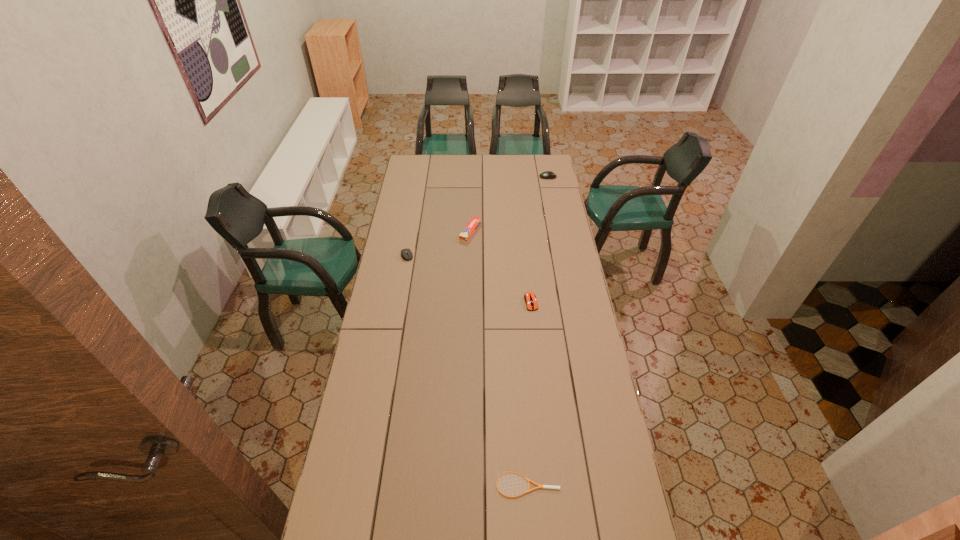
Identify the location of vacant area situated 0.370m on the front of the fourth nearest object. Image resolution: width=960 pixels, height=540 pixels. (469, 296).

Find the location of a particular element. The image size is (960, 540). blank area located 0.060m on the wheel side of the farthest object is located at coordinates (529, 177).

Find the location of `vacant space situated on the wheel side of the farthest object`. vacant space situated on the wheel side of the farthest object is located at coordinates (475, 177).

I want to click on vacant area situated on the wheel side of the farthest object, so click(x=484, y=177).

Locate an element on the screen. free location located 0.260m on the front of the leftmost computer mouse is located at coordinates (399, 301).

Locate an element on the screen. vacant area located on the front of the fourth farthest object is located at coordinates (538, 367).

Find the location of a particular element. The image size is (960, 540). free space located 0.390m on the left of the tennis racket is located at coordinates (372, 484).

The height and width of the screenshot is (540, 960). Identify the location of object that is at the far edge. (548, 174).

The image size is (960, 540). What are the coordinates of `object at the left edge` in the screenshot? It's located at (404, 252).

You are a GUI agent. You are given a task and a screenshot of the screen. Output one action in this format:
    pyautogui.click(x=<x>, y=<y>)
    Task: Click on the object that is at the right edge
    The image size is (960, 540).
    Given the screenshot: What is the action you would take?
    pyautogui.click(x=548, y=174)